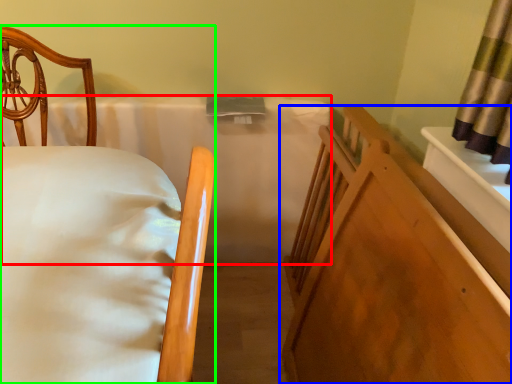
Question: Which is farther away from mattress (highlighted by a red box)? furniture (highlighted by a blue box) or bed (highlighted by a green box)?

Choices:
 (A) furniture
 (B) bed

Answer: (B)